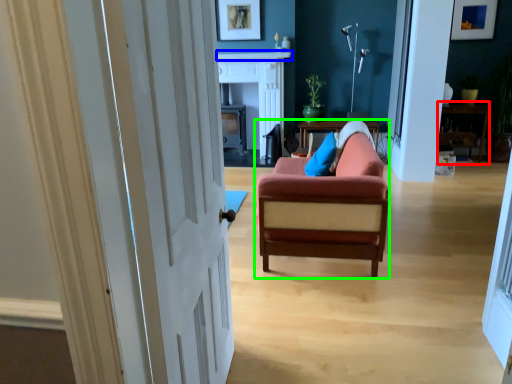
Question: Based on their relative distances, which object is farther from table (highlighted by a red box)? Choose from mantle (highlighted by a blue box) and chair (highlighted by a green box).

Choices:
 (A) mantle
 (B) chair

Answer: (B)